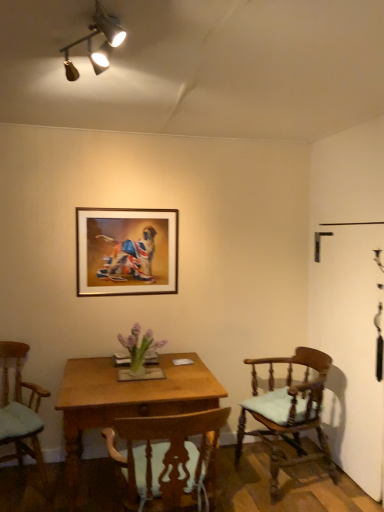
Question: Considering the relative positions of light brown wood chair at right, which is the third chair in left-to-right order, and gold-framed picture at upper center in the image provided, is light brown wood chair at right, which is the third chair in left-to-right order, to the right of gold-framed picture at upper center from the viewer's perspective?

Choices:
 (A) yes
 (B) no

Answer: (A)

Question: From the image's perspective, is light brown wood chair at right, marked as the first chair in a right-to-left arrangement, below gold-framed picture at upper center?

Choices:
 (A) no
 (B) yes

Answer: (B)

Question: Are light brown wood chair at right, which is the third chair in left-to-right order, and gold-framed picture at upper center beside each other?

Choices:
 (A) yes
 (B) no

Answer: (B)

Question: Can you confirm if light brown wood chair at right, marked as the first chair in a right-to-left arrangement, is taller than gold-framed picture at upper center?

Choices:
 (A) no
 (B) yes

Answer: (B)

Question: From a real-world perspective, is light brown wood chair at right, marked as the first chair in a right-to-left arrangement, located higher than gold-framed picture at upper center?

Choices:
 (A) no
 (B) yes

Answer: (A)

Question: From a real-world perspective, is wooden desk at center positioned above or below light brown wood chair at right, marked as the first chair in a right-to-left arrangement?

Choices:
 (A) below
 (B) above

Answer: (A)

Question: Is wooden desk at center taller or shorter than light brown wood chair at right, marked as the first chair in a right-to-left arrangement?

Choices:
 (A) short
 (B) tall

Answer: (A)

Question: In the image, is wooden desk at center positioned in front of or behind light brown wood chair at right, which is the third chair in left-to-right order?

Choices:
 (A) front
 (B) behind

Answer: (A)

Question: Considering the positions of wooden desk at center and light brown wood chair at right, which is the third chair in left-to-right order, in the image, is wooden desk at center wider or thinner than light brown wood chair at right, which is the third chair in left-to-right order,?

Choices:
 (A) wide
 (B) thin

Answer: (A)

Question: Looking at their shapes, would you say wooden chair at center, which is counted as the 2th chair, starting from the left, is wider or thinner than wooden desk at center?

Choices:
 (A) thin
 (B) wide

Answer: (A)

Question: Which is correct: wooden chair at center, which is counted as the 2th chair, starting from the left, is inside wooden desk at center, or outside of it?

Choices:
 (A) outside
 (B) inside

Answer: (A)

Question: In the image, is wooden chair at center, which is counted as the 2th chair, starting from the left, on the left side or the right side of wooden desk at center?

Choices:
 (A) left
 (B) right

Answer: (B)

Question: Is point (160, 492) closer or farther from the camera than point (77, 417)?

Choices:
 (A) closer
 (B) farther

Answer: (A)

Question: Relative to light brown wood chair at right, marked as the first chair in a right-to-left arrangement, is wooden chair at center, which is counted as the 2th chair, starting from the left, in front or behind?

Choices:
 (A) front
 (B) behind

Answer: (A)

Question: Is point [x=188, y=415] positioned closer to the camera than point [x=302, y=400]?

Choices:
 (A) farther
 (B) closer

Answer: (B)